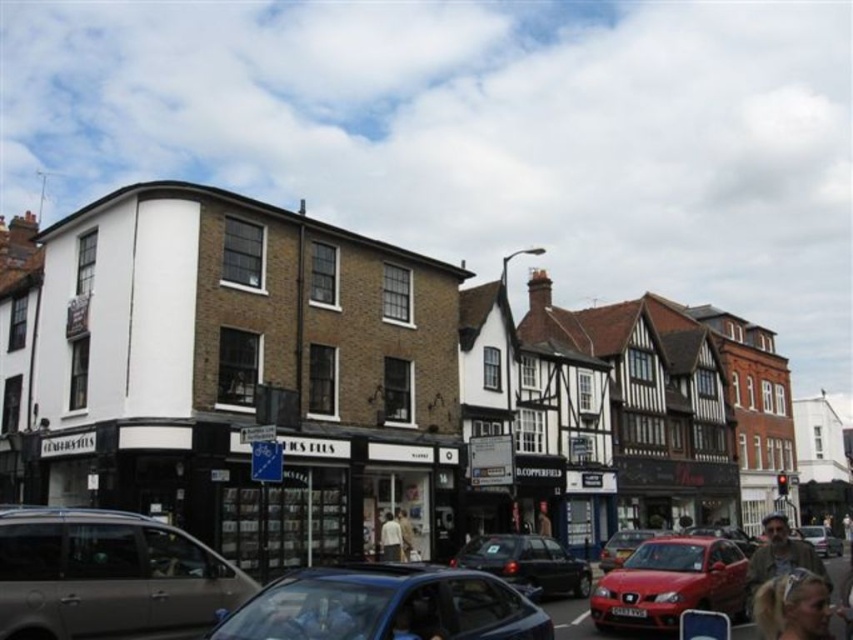
You are a delivery person trying to park your van in the street. You see a shiny red car at lower right and a brown leather jacket at lower right. Which vehicle has more space to park next to it?

The shiny red car at lower right has a lesser width compared to the brown leather jacket at lower right, so the brown leather jacket at lower right provides more space for parking next to it.

You are a pedestrian standing at the center of the street. You see a shiny red car at lower right and a brown leather jacket at lower right. Which object is closer to the ground?

The shiny red car at lower right has a lesser height compared to the brown leather jacket at lower right, so the shiny red car at lower right is closer to the ground.

You are standing on the sidewalk and see both the shiny red car at lower right and the brown leather jacket at lower right. Which object is positioned higher relative to the other?

The shiny red car at lower right is above the brown leather jacket at lower right, so the shiny red car at lower right is positioned higher.